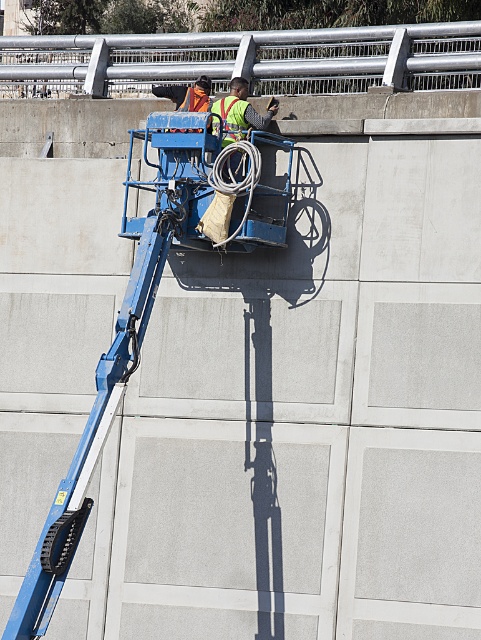
Does reflective safety vest at upper center have a greater height compared to reflective yellow safety vest at center?

Yes.

Describe the element at coordinates (188, 93) in the screenshot. The image size is (481, 640). I see `reflective safety vest at upper center` at that location.

The width and height of the screenshot is (481, 640). Find the location of `reflective safety vest at upper center`. reflective safety vest at upper center is located at coordinates (188, 93).